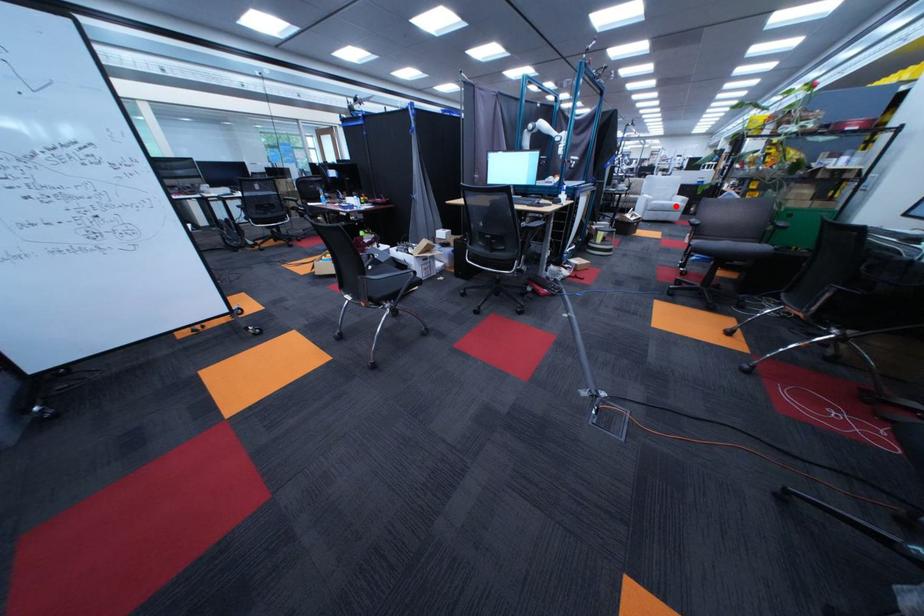
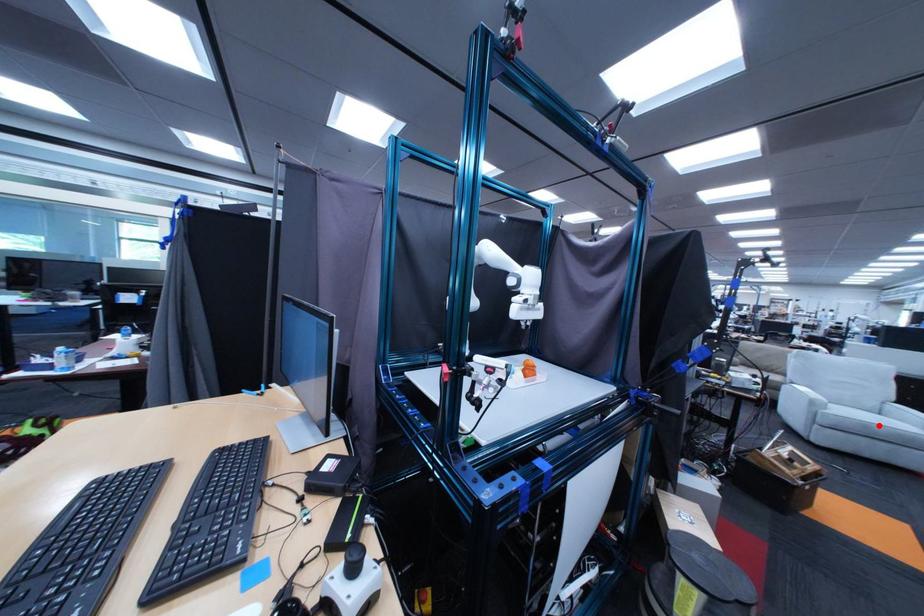
I am providing you with two images of the same scene from different viewpoints. A red point is marked on the first image and another point is marked on the second image. Do the highlighted points in image1 and image2 indicate the same real-world spot?

Yes